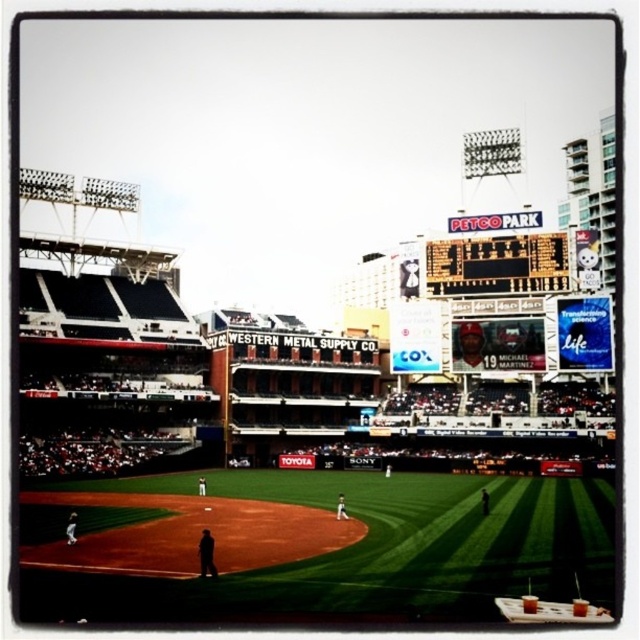
You are a photographer standing at the edge of the field at Petco Park. You want to take a photo that includes both the point at coordinates point (60, 563) and point (339, 500). Which point should you focus on first to ensure both are in sharp focus?

You should focus on point (60, 563) first because it is closer to you than point (339, 500). This will ensure the closer point is in focus, and the farther point will also be within the depth of field.

You are a drone operator trying to capture aerial footage of the baseball game at Petco Park. You need to ensure your drone stays above the infield dirt to avoid disturbing the players. Given the coordinates provided, is the point at point (316,547) located on the infield dirt or the green grass at center?

The point (316,547) is on green grass at center, so the drone is not above the infield dirt and should adjust its position to stay within the infield dirt area to avoid disturbing the players.

You are a photographer trying to capture a photo of the black fabric man at center without the metallic scoreboard at upper center appearing in the frame. Based on their positions, which direction should you move your camera to avoid the scoreboard?

Since the metallic scoreboard at upper center is to the right of the black fabric man at center, you should move your camera to the right to position the black fabric man at center away from the scoreboard.